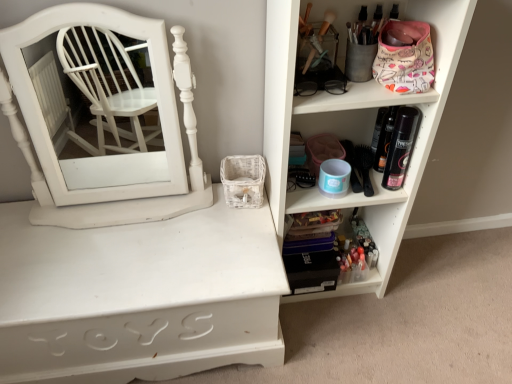
What is the approximate width of translucent plastic makeup at lower right, marked as the second shelf in a right-to-left arrangement?

6.36 inches.

The height and width of the screenshot is (384, 512). I want to click on white wood medicine cabinet at left, so click(x=106, y=123).

Where is `translucent plastic makeup at lower right, marked as the second shelf in a right-to-left arrangement`? translucent plastic makeup at lower right, marked as the second shelf in a right-to-left arrangement is located at coordinates (344, 289).

Based on the photo, which is nearer, (248, 227) or (55, 199)?

The point (248, 227) is more forward.

From a real-world perspective, which is physically below, white painted wood shelf at center, marked as the 1th shelf in a left-to-right arrangement, or white wood medicine cabinet at left?

Answer: white painted wood shelf at center, marked as the 1th shelf in a left-to-right arrangement.

How different are the orientations of white painted wood shelf at center, which is counted as the 3th shelf, starting from the right, and white wood medicine cabinet at left in degrees?

The angular difference between white painted wood shelf at center, which is counted as the 3th shelf, starting from the right, and white wood medicine cabinet at left is 0.326 degrees.

From the image's perspective, is white painted wood shelf at center, marked as the 1th shelf in a left-to-right arrangement, located beneath white wood medicine cabinet at left?

Yes.

Is translucent plastic makeup at lower right, marked as the second shelf in a right-to-left arrangement, touching white plastic shelf at upper right, placed as the third shelf when sorted from left to right?

translucent plastic makeup at lower right, marked as the second shelf in a right-to-left arrangement, is not next to white plastic shelf at upper right, placed as the third shelf when sorted from left to right, and they're not touching.

Visually, is translucent plastic makeup at lower right, marked as the second shelf in a right-to-left arrangement, positioned to the left or to the right of white plastic shelf at upper right, placed as the third shelf when sorted from left to right?

Clearly, translucent plastic makeup at lower right, marked as the second shelf in a right-to-left arrangement, is on the left of white plastic shelf at upper right, placed as the third shelf when sorted from left to right, in the image.

Considering the relative sizes of translucent plastic makeup at lower right, marked as the second shelf in a right-to-left arrangement, and white plastic shelf at upper right, placed as the third shelf when sorted from left to right, in the image provided, is translucent plastic makeup at lower right, marked as the second shelf in a right-to-left arrangement, taller than white plastic shelf at upper right, placed as the third shelf when sorted from left to right,?

In fact, translucent plastic makeup at lower right, marked as the second shelf in a right-to-left arrangement, may be shorter than white plastic shelf at upper right, placed as the third shelf when sorted from left to right.

Is translucent plastic makeup at lower right, which appears as the second shelf when viewed from the left, inside or outside of white plastic shelf at upper right, placed as the third shelf when sorted from left to right?

translucent plastic makeup at lower right, which appears as the second shelf when viewed from the left, can be found inside white plastic shelf at upper right, placed as the third shelf when sorted from left to right.

From the picture: Could you tell me if white wood medicine cabinet at left is turned towards white painted wood shelf at center, marked as the 1th shelf in a left-to-right arrangement?

No, white wood medicine cabinet at left does not turn towards white painted wood shelf at center, marked as the 1th shelf in a left-to-right arrangement.

From a real-world perspective, does white wood medicine cabinet at left sit lower than white painted wood shelf at center, which is counted as the 3th shelf, starting from the right?

Actually, white wood medicine cabinet at left is physically above white painted wood shelf at center, which is counted as the 3th shelf, starting from the right, in the real world.

Which is in front, white wood medicine cabinet at left or white painted wood shelf at center, marked as the 1th shelf in a left-to-right arrangement?

white wood medicine cabinet at left is closer to the camera.

From the image's perspective, is white wood medicine cabinet at left on white painted wood shelf at center, which is counted as the 3th shelf, starting from the right?

Yes, from the image's perspective, white wood medicine cabinet at left is above white painted wood shelf at center, which is counted as the 3th shelf, starting from the right.

Would you say translucent plastic makeup at lower right, marked as the second shelf in a right-to-left arrangement, is part of white painted wood shelf at center, marked as the 1th shelf in a left-to-right arrangement,'s contents?

No.

Is point (258, 309) positioned in front of point (382, 275)?

Yes, it is.

The image size is (512, 384). I want to click on the 1st shelf to the right when counting from the white painted wood shelf at center, which is counted as the 3th shelf, starting from the right, so click(344, 289).

Does point (221, 198) come in front of point (436, 35)?

No, it is behind (436, 35).

Does white painted wood shelf at center, which is counted as the 3th shelf, starting from the right, lie in front of white plastic shelf at upper right, placed as the third shelf when sorted from left to right?

No.

Which of these two, white painted wood shelf at center, which is counted as the 3th shelf, starting from the right, or white plastic shelf at upper right, the first shelf positioned from the right, is wider?

white painted wood shelf at center, which is counted as the 3th shelf, starting from the right.

Based on their positions, is white painted wood shelf at center, marked as the 1th shelf in a left-to-right arrangement, located to the left or right of white plastic shelf at upper right, placed as the third shelf when sorted from left to right?

From the image, it's evident that white painted wood shelf at center, marked as the 1th shelf in a left-to-right arrangement, is to the left of white plastic shelf at upper right, placed as the third shelf when sorted from left to right.

Considering the relative sizes of translucent plastic makeup at lower right, marked as the second shelf in a right-to-left arrangement, and white wood medicine cabinet at left in the image provided, is translucent plastic makeup at lower right, marked as the second shelf in a right-to-left arrangement, shorter than white wood medicine cabinet at left?

Yes.

Visually, is translucent plastic makeup at lower right, marked as the second shelf in a right-to-left arrangement, positioned to the left or to the right of white wood medicine cabinet at left?

Clearly, translucent plastic makeup at lower right, marked as the second shelf in a right-to-left arrangement, is on the right of white wood medicine cabinet at left in the image.

From the image's perspective, which is above, translucent plastic makeup at lower right, marked as the second shelf in a right-to-left arrangement, or white wood medicine cabinet at left?

white wood medicine cabinet at left, from the image's perspective.

Considering their positions, is white plastic shelf at upper right, the first shelf positioned from the right, located in front of or behind translucent plastic makeup at lower right, marked as the second shelf in a right-to-left arrangement?

white plastic shelf at upper right, the first shelf positioned from the right, is positioned closer to the viewer than translucent plastic makeup at lower right, marked as the second shelf in a right-to-left arrangement.

From the picture: Considering the sizes of objects white plastic shelf at upper right, the first shelf positioned from the right, and translucent plastic makeup at lower right, marked as the second shelf in a right-to-left arrangement, in the image provided, who is shorter, white plastic shelf at upper right, the first shelf positioned from the right, or translucent plastic makeup at lower right, marked as the second shelf in a right-to-left arrangement,?

Standing shorter between the two is translucent plastic makeup at lower right, marked as the second shelf in a right-to-left arrangement.

Can we say white plastic shelf at upper right, placed as the third shelf when sorted from left to right, lies outside translucent plastic makeup at lower right, marked as the second shelf in a right-to-left arrangement?

Yes, white plastic shelf at upper right, placed as the third shelf when sorted from left to right, is located beyond the bounds of translucent plastic makeup at lower right, marked as the second shelf in a right-to-left arrangement.

Which of these two, white plastic shelf at upper right, the first shelf positioned from the right, or translucent plastic makeup at lower right, marked as the second shelf in a right-to-left arrangement, is thinner?

Thinner between the two is translucent plastic makeup at lower right, marked as the second shelf in a right-to-left arrangement.

What are the coordinates of `the 3rd shelf below when counting from the white wood medicine cabinet at left (from the image's perspective)` in the screenshot? It's located at coord(139,296).

Where is `the 1st shelf counting from the left side of the white plastic shelf at upper right, placed as the third shelf when sorted from left to right`? The image size is (512, 384). the 1st shelf counting from the left side of the white plastic shelf at upper right, placed as the third shelf when sorted from left to right is located at coordinates (344, 289).

Based on their spatial positions, is white painted wood shelf at center, which is counted as the 3th shelf, starting from the right, or white wood medicine cabinet at left further from white plastic shelf at upper right, the first shelf positioned from the right?

The object further to white plastic shelf at upper right, the first shelf positioned from the right, is white wood medicine cabinet at left.

Estimate the real-world distances between objects in this image. Which object is closer to white wood medicine cabinet at left, white painted wood shelf at center, which is counted as the 3th shelf, starting from the right, or white plastic shelf at upper right, the first shelf positioned from the right?

white painted wood shelf at center, which is counted as the 3th shelf, starting from the right, lies closer to white wood medicine cabinet at left than the other object.

Which object lies nearer to the anchor point translucent plastic makeup at lower right, marked as the second shelf in a right-to-left arrangement, white painted wood shelf at center, which is counted as the 3th shelf, starting from the right, or white wood medicine cabinet at left?

white painted wood shelf at center, which is counted as the 3th shelf, starting from the right.

Considering their positions, is translucent plastic makeup at lower right, which appears as the second shelf when viewed from the left, positioned closer to white painted wood shelf at center, marked as the 1th shelf in a left-to-right arrangement, than white wood medicine cabinet at left?

white wood medicine cabinet at left.

Based on their spatial positions, is white plastic shelf at upper right, the first shelf positioned from the right, or white wood medicine cabinet at left closer to translucent plastic makeup at lower right, which appears as the second shelf when viewed from the left?

white plastic shelf at upper right, the first shelf positioned from the right, lies closer to translucent plastic makeup at lower right, which appears as the second shelf when viewed from the left, than the other object.

In the scene shown: Considering their positions, is white plastic shelf at upper right, placed as the third shelf when sorted from left to right, positioned further to white wood medicine cabinet at left than translucent plastic makeup at lower right, which appears as the second shelf when viewed from the left?

translucent plastic makeup at lower right, which appears as the second shelf when viewed from the left.

Considering their positions, is white wood medicine cabinet at left positioned further to white plastic shelf at upper right, placed as the third shelf when sorted from left to right, than white painted wood shelf at center, which is counted as the 3th shelf, starting from the right?

Based on the image, white wood medicine cabinet at left appears to be further to white plastic shelf at upper right, placed as the third shelf when sorted from left to right.

Based on their spatial positions, is white painted wood shelf at center, marked as the 1th shelf in a left-to-right arrangement, or white plastic shelf at upper right, placed as the third shelf when sorted from left to right, further from translucent plastic makeup at lower right, marked as the second shelf in a right-to-left arrangement?

white painted wood shelf at center, marked as the 1th shelf in a left-to-right arrangement, is positioned further to the anchor translucent plastic makeup at lower right, marked as the second shelf in a right-to-left arrangement.

Where is `shelf located between white wood medicine cabinet at left and translucent plastic makeup at lower right, which appears as the second shelf when viewed from the left, in the left-right direction`? shelf located between white wood medicine cabinet at left and translucent plastic makeup at lower right, which appears as the second shelf when viewed from the left, in the left-right direction is located at coordinates (139, 296).

You are a GUI agent. You are given a task and a screenshot of the screen. Output one action in this format:
    pyautogui.click(x=<x>, y=<y>)
    Task: Click on the shelf situated between white painted wood shelf at center, which is counted as the 3th shelf, starting from the right, and white plastic shelf at upper right, the first shelf positioned from the right, from left to right
    
    Given the screenshot: What is the action you would take?
    pyautogui.click(x=344, y=289)